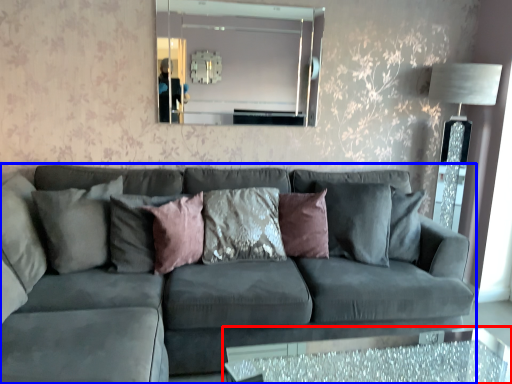
Question: Which point is further to the camera, table (highlighted by a red box) or studio couch (highlighted by a blue box)?

Choices:
 (A) table
 (B) studio couch

Answer: (A)